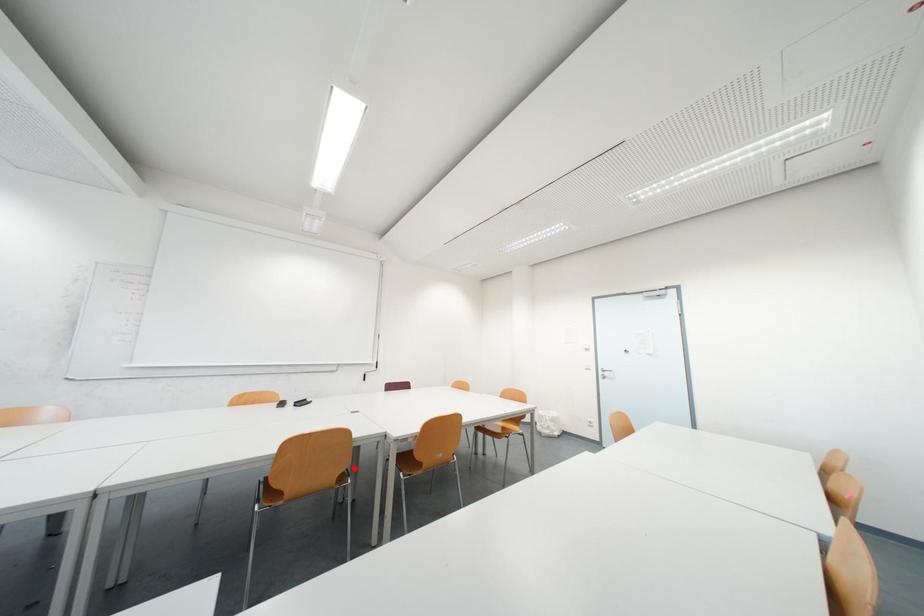
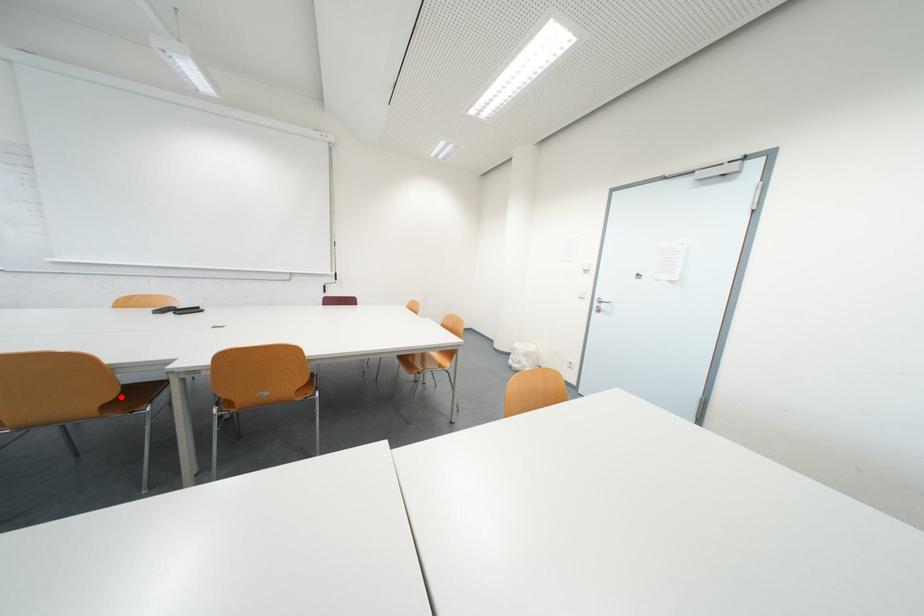
I am providing you with two images of the same scene from different viewpoints. A red point is marked on the first image and another point is marked on the second image. Does the point marked in image1 correspond to the same location as the one in image2?

Yes